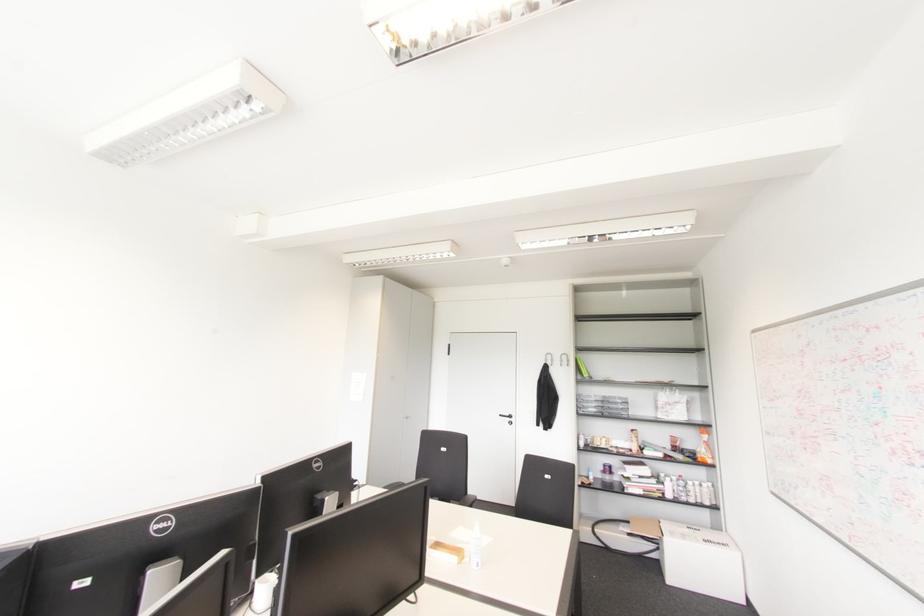
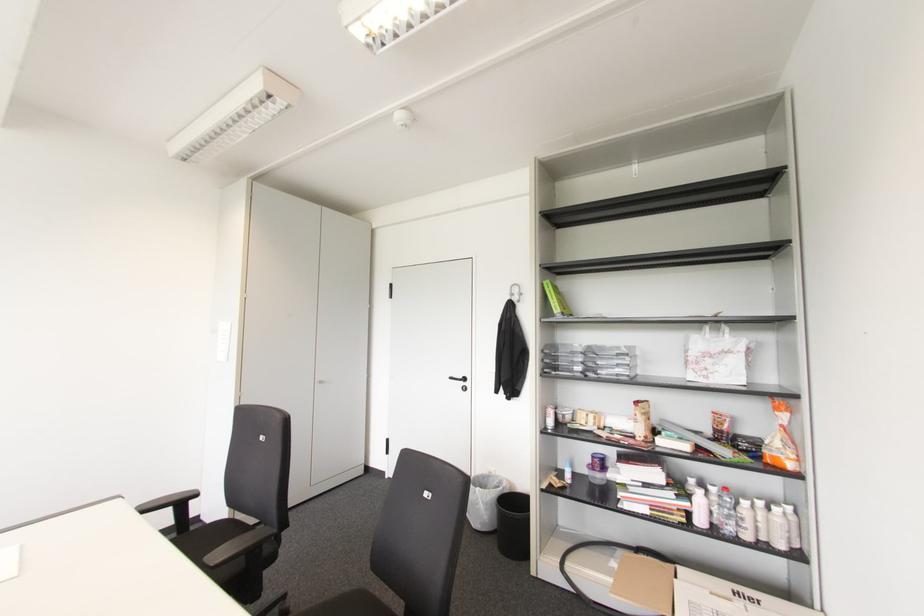
In the second image, find the point that corresponds to [707,503] in the first image.

(781, 546)